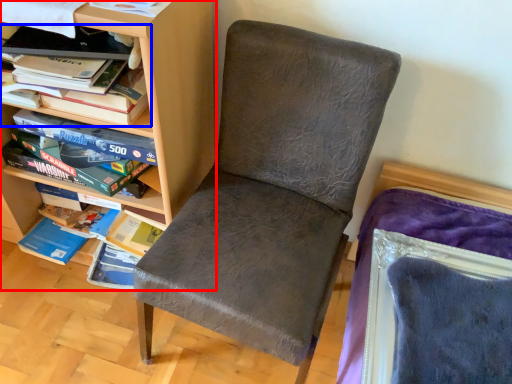
Question: Which point is closer to the camera, shelf (highlighted by a red box) or book (highlighted by a blue box)?

Choices:
 (A) shelf
 (B) book

Answer: (A)